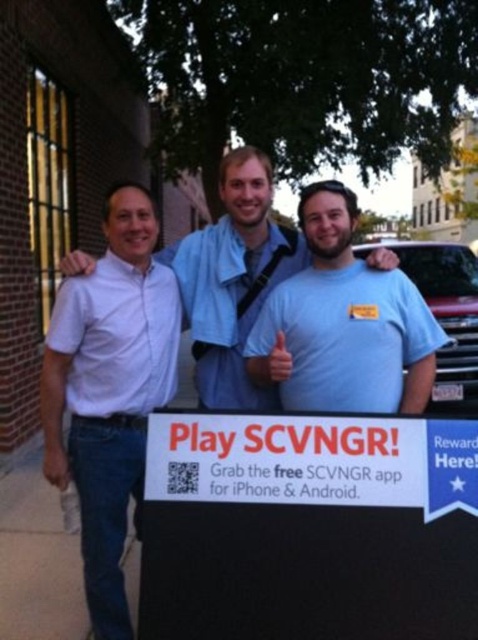
You are taking a photo of the three people in the scene. The white shirt at left and the white paper sign at lower center are both in your frame. Which one is more to the left?

The white shirt at left is more to the left than the white paper sign at lower center because it is positioned on the left side of the sign.